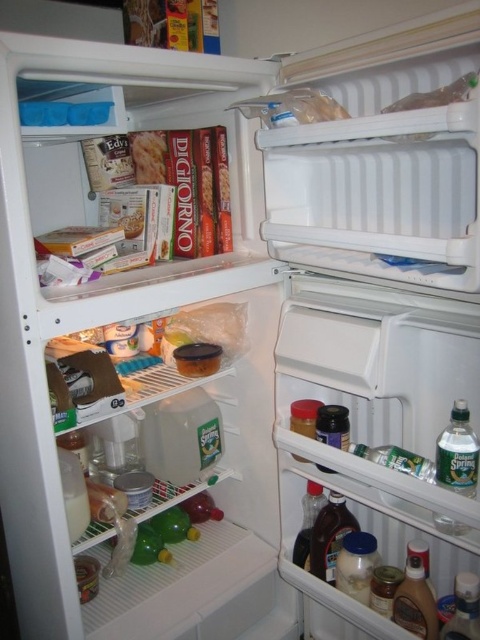
You are organizing the items in the refrigerator and need to place a new item between the clear plastic water at lower right and the dark brown glass at lower center. Is there enough space between them to fit a 10 cm wide container?

The clear plastic water at lower right is positioned on the right side of dark brown glass at lower center. Since the distance between them isn not specified, but the clear plastic water is to the right of the dark brown glass, there might be space, but it depends on their exact positions. However, without specific measurements, we can only confirm their relative positions, not the available space.

You are trying to reach two points inside the open refrigerator. One point is at coordinate point(445,472) and the other is at coordinate point(317,544). Which point would be easier to reach without moving your hand too much?

Point(445,472) is closer to the camera than point(317,544), so it would be easier to reach without moving your hand too much.

You are organizing the fridge and need to move the clear plastic water at lower right and the dark brown glass at lower center. Which item is located above the other?

The clear plastic water at lower right is positioned over the dark brown glass at lower center, so it is above it.